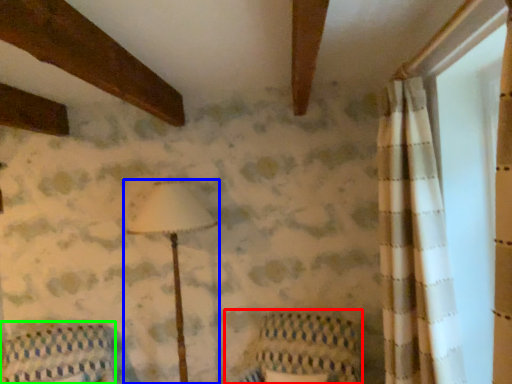
Question: Which object is positioned farthest from armchair (highlighted by a red box)? Select from lamp (highlighted by a blue box) and furniture (highlighted by a green box).

Choices:
 (A) lamp
 (B) furniture

Answer: (B)